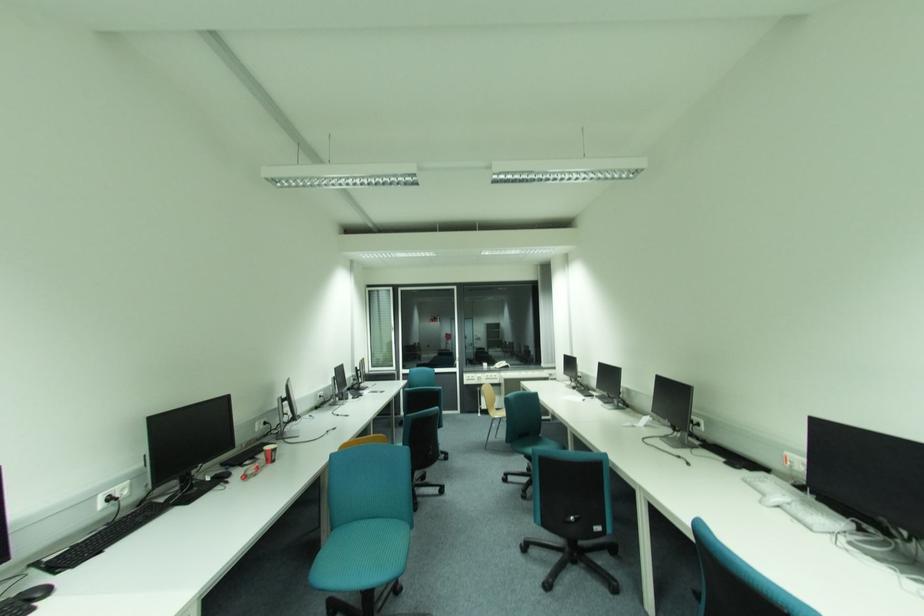
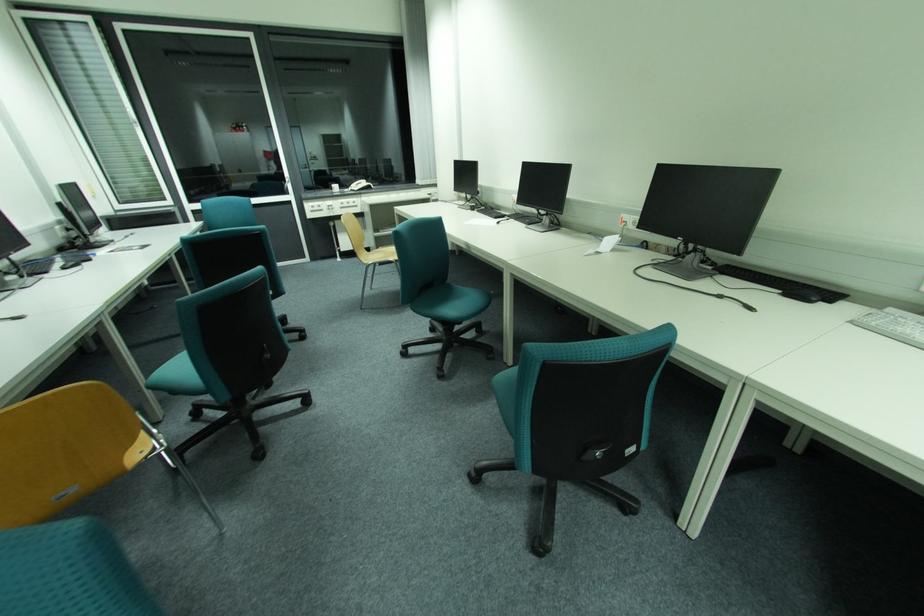
Where in the second image is the point corresponding to (436,454) from the first image?

(273, 357)